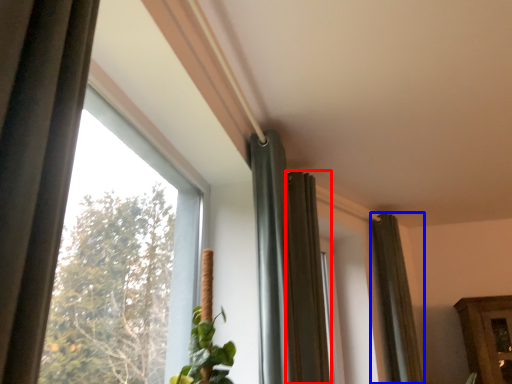
Question: Which object appears closest to the camera in this image, curtain (highlighted by a red box) or curtain (highlighted by a blue box)?

Choices:
 (A) curtain
 (B) curtain

Answer: (A)